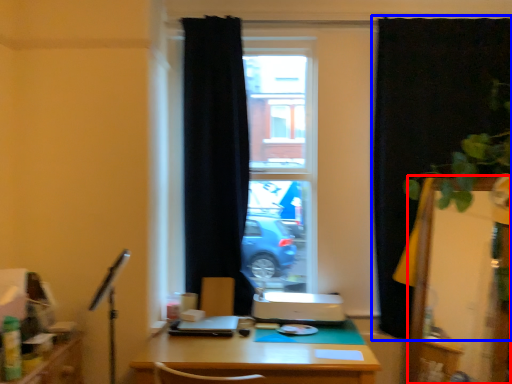
Question: Among these objects, which one is farthest to the camera, screen door (highlighted by a red box) or curtain (highlighted by a blue box)?

Choices:
 (A) screen door
 (B) curtain

Answer: (B)